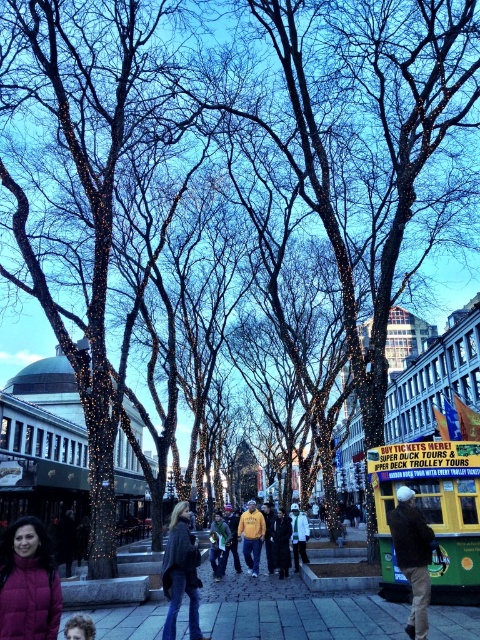
Who is more forward, [249,637] or [248,525]?

Point [249,637]

Between dark gray stone pavement at lower left and matte yellow hoodie at center, which one has less height?

matte yellow hoodie at center

Describe the element at coordinates (292, 611) in the screenshot. Image resolution: width=480 pixels, height=640 pixels. I see `dark gray stone pavement at lower left` at that location.

At what (x,y) coordinates should I click in order to perform the action: click on dark gray stone pavement at lower left. Please return your answer as a coordinate pair (x, y). This screenshot has width=480, height=640. Looking at the image, I should click on (292, 611).

Who is positioned more to the right, dark blue jeans at center or curly hair at center?

From the viewer's perspective, dark blue jeans at center appears more on the right side.

Does dark blue jeans at center have a lesser height compared to curly hair at center?

Incorrect, dark blue jeans at center's height does not fall short of curly hair at center's.

Does point (194, 582) come farther from viewer compared to point (84, 636)?

That is True.

Identify the location of dark blue jeans at center. Image resolution: width=480 pixels, height=640 pixels. (180, 572).

Which is below, dark blue jeans at center or white matte jacket at center?

Positioned lower is white matte jacket at center.

Image resolution: width=480 pixels, height=640 pixels. What do you see at coordinates (180, 572) in the screenshot?
I see `dark blue jeans at center` at bounding box center [180, 572].

What do you see at coordinates (180, 572) in the screenshot? I see `dark blue jeans at center` at bounding box center [180, 572].

You are a GUI agent. You are given a task and a screenshot of the screen. Output one action in this format:
    pyautogui.click(x=<x>, y=<y>)
    Task: Click on the dark blue jeans at center
    
    Given the screenshot: What is the action you would take?
    pyautogui.click(x=180, y=572)